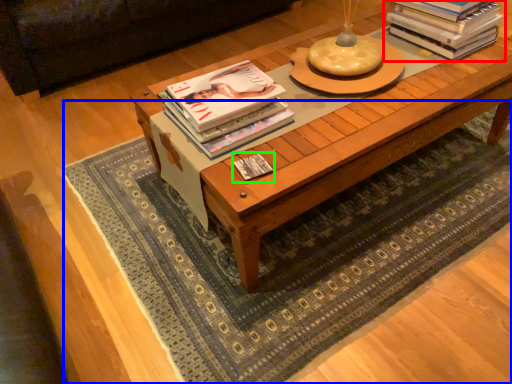
Question: Estimate the real-world distances between objects in this image. Which object is farther from book (highlighted by a red box), mat (highlighted by a blue box) or book (highlighted by a green box)?

Choices:
 (A) mat
 (B) book

Answer: (B)